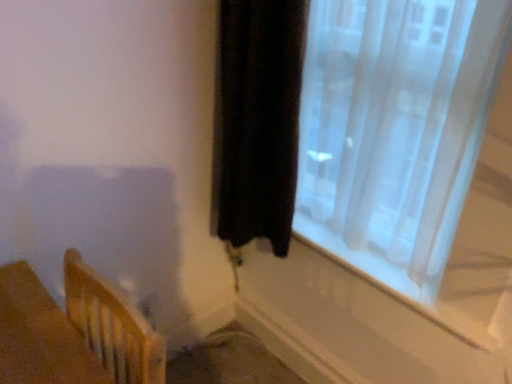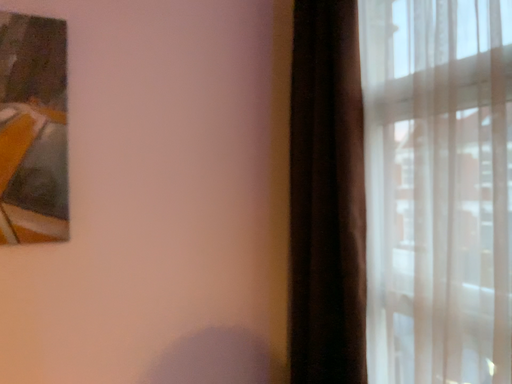
Question: How did the camera likely rotate when shooting the video?

Choices:
 (A) rotated downward
 (B) rotated upward

Answer: (B)